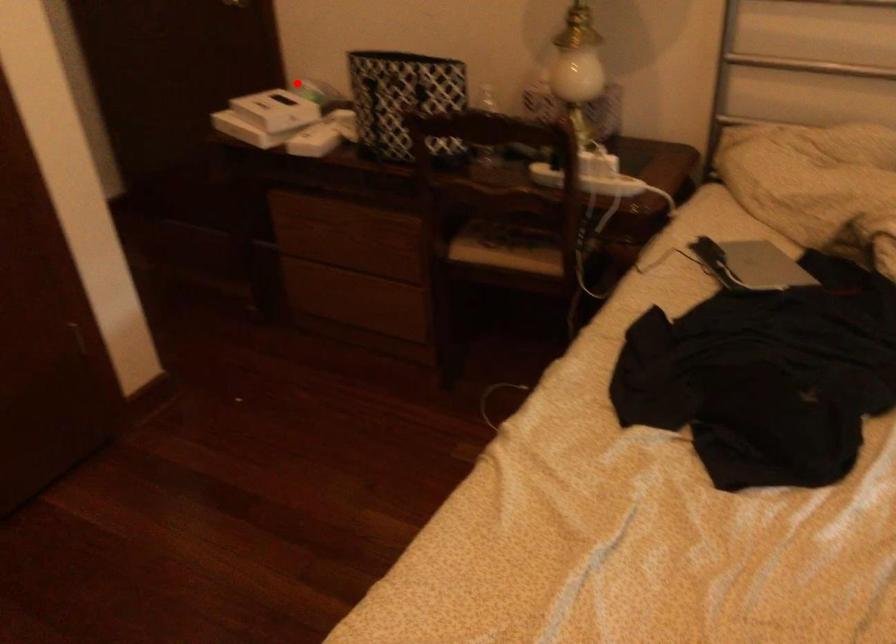
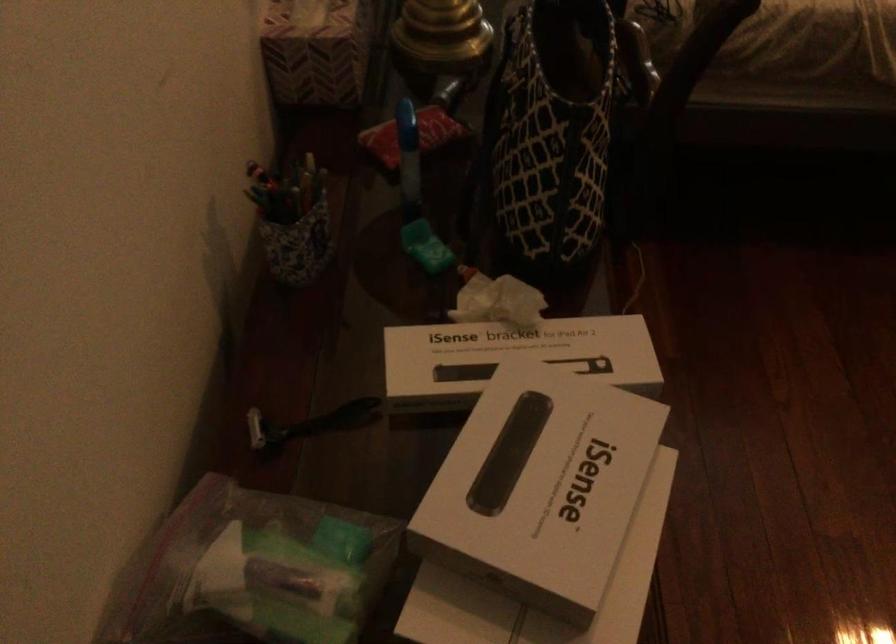
The point at the highlighted location is marked in the first image. Where is the corresponding point in the second image?

(252, 571)